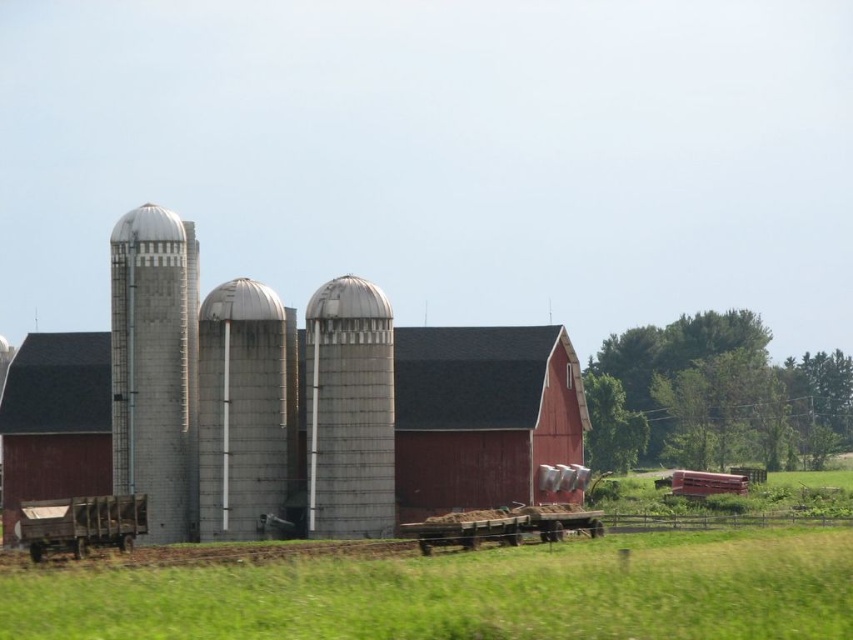
Based on the scene description, if you were standing at the base of the gray concrete silo at left, which direction would the red painted wood barn at center be relative to you?

The red painted wood barn at center is located below the gray concrete silo at left, so if you were standing at the base of the gray concrete silo at left, the barn would be directly in front of you at a lower elevation.

Based on the photo, you are a farmer who needs to access the ladders on both the gray concrete silo at left and the sanded concrete silo at center. Since you can only climb one ladder at a time, which silo should you prioritize climbing first to reach the one above without having to climb down?

You should climb the gray concrete silo at left first because it is positioned under the sanded concrete silo at center, so after reaching the top of the gray one, you can move directly to the sanded one above without needing to descend.

You are a farmer who needs to move a heavy load from the red painted wood barn at center to the gray concrete silo at left. Your tractor can carry the load but has a maximum towing capacity of 6 meters. Can you safely transport the load between these two structures without needing to unload midway?

The distance between the red painted wood barn at center and the gray concrete silo at left is 6.19 meters. Since the tractor can only tow up to 6 meters, the distance is slightly longer than the tractor can handle. Therefore, you cannot safely transport the load without unloading midway.